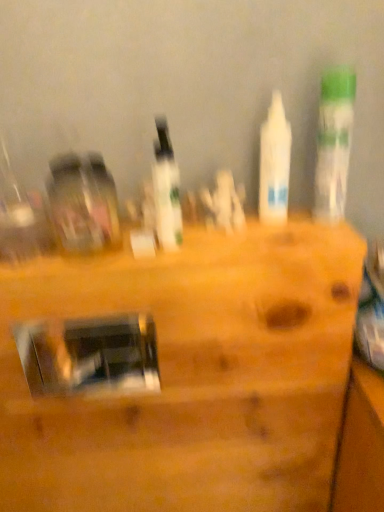
Question: From a real-world perspective, is white glossy bottle at upper right, the first bottle viewed from the right, under white glossy bottle at center, arranged as the 3th bottle when viewed from the right?

Choices:
 (A) yes
 (B) no

Answer: (B)

Question: Considering the relative positions of white glossy bottle at upper right, the third bottle positioned from the left, and white glossy bottle at center, the first bottle in the left-to-right sequence, in the image provided, is white glossy bottle at upper right, the third bottle positioned from the left, to the right of white glossy bottle at center, the first bottle in the left-to-right sequence, from the viewer's perspective?

Choices:
 (A) no
 (B) yes

Answer: (B)

Question: From a real-world perspective, does white glossy bottle at upper right, the first bottle viewed from the right, stand above white glossy bottle at center, arranged as the 3th bottle when viewed from the right?

Choices:
 (A) yes
 (B) no

Answer: (A)

Question: Does white glossy bottle at upper right, the third bottle positioned from the left, contain white glossy bottle at center, arranged as the 3th bottle when viewed from the right?

Choices:
 (A) yes
 (B) no

Answer: (B)

Question: Is white glossy bottle at upper right, the third bottle positioned from the left, outside of white glossy bottle at center, arranged as the 3th bottle when viewed from the right?

Choices:
 (A) no
 (B) yes

Answer: (B)

Question: Does point (160, 160) appear closer or farther from the camera than point (1, 312)?

Choices:
 (A) farther
 (B) closer

Answer: (B)

Question: In the image, is white glossy bottle at center, the first bottle in the left-to-right sequence, on the left side or the right side of metallic silver mirror at center?

Choices:
 (A) left
 (B) right

Answer: (B)

Question: Looking at the image, does white glossy bottle at center, the first bottle in the left-to-right sequence, seem bigger or smaller compared to metallic silver mirror at center?

Choices:
 (A) small
 (B) big

Answer: (A)

Question: In the image, is white glossy bottle at center, the first bottle in the left-to-right sequence, positioned in front of or behind metallic silver mirror at center?

Choices:
 (A) behind
 (B) front

Answer: (B)

Question: Based on their sizes in the image, would you say metallic silver mirror at center is bigger or smaller than white matte bottle at center, the 2th bottle in the left-to-right sequence?

Choices:
 (A) small
 (B) big

Answer: (B)

Question: Is metallic silver mirror at center wider or thinner than white matte bottle at center, the 2th bottle in the left-to-right sequence?

Choices:
 (A) thin
 (B) wide

Answer: (B)

Question: Is point (347, 271) closer or farther from the camera than point (278, 181)?

Choices:
 (A) closer
 (B) farther

Answer: (A)

Question: From a real-world perspective, is metallic silver mirror at center physically located above or below white matte bottle at center, the 2th bottle in the left-to-right sequence?

Choices:
 (A) above
 (B) below

Answer: (B)

Question: Considering the positions of point (281, 176) and point (44, 437), is point (281, 176) closer or farther from the camera than point (44, 437)?

Choices:
 (A) farther
 (B) closer

Answer: (B)

Question: In terms of width, does white matte bottle at center, the 2th bottle in the left-to-right sequence, look wider or thinner when compared to metallic silver mirror at center?

Choices:
 (A) wide
 (B) thin

Answer: (B)